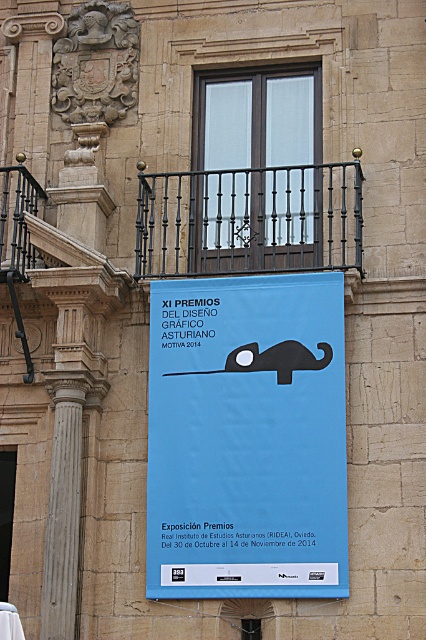
Who is positioned more to the left, blue paper poster at center or black wrought iron at upper center?

blue paper poster at center is more to the left.

Is blue paper poster at center to the left of black wrought iron at upper center from the viewer's perspective?

Indeed, blue paper poster at center is positioned on the left side of black wrought iron at upper center.

Between point (192, 333) and point (157, 208), which one is positioned in front?

Point (192, 333)

Find the location of a particular element. blue paper poster at center is located at coordinates (247, 436).